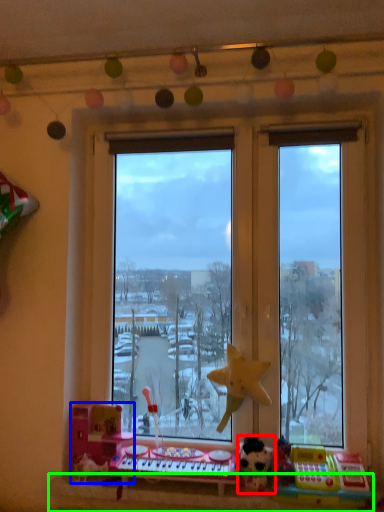
Question: Which object is the farthest from toy (highlighted by a red box)? Choose among these: toy (highlighted by a blue box) or window sill (highlighted by a green box).

Choices:
 (A) toy
 (B) window sill

Answer: (A)